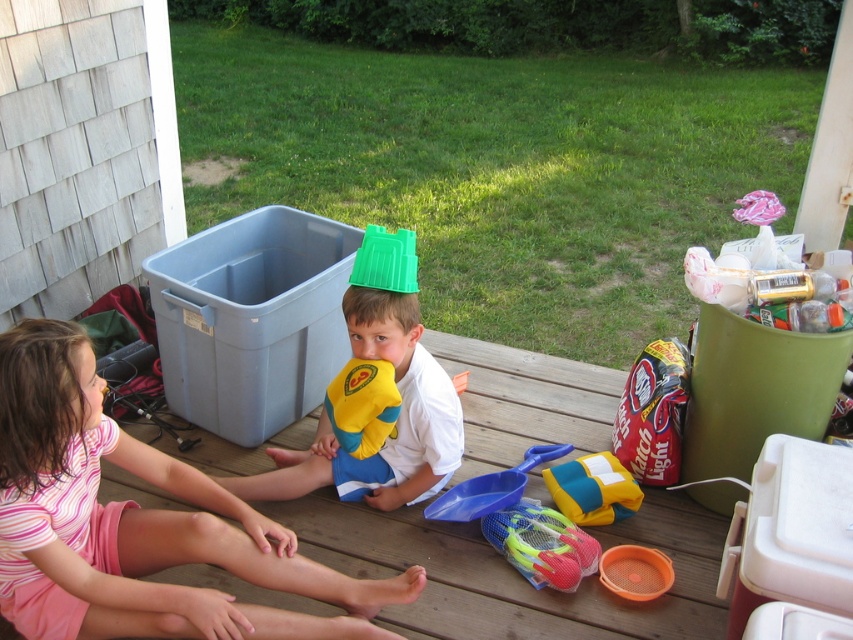
Question: Which point is farther to the camera?

Choices:
 (A) (563, 490)
 (B) (480, 490)
 (C) (276, 611)
 (D) (512, 532)

Answer: (B)

Question: Which object is positioned farthest from the pink cotton dress at lower left?

Choices:
 (A) neon green plastic bucket at lower center
 (B) green plastic bucket at center
 (C) yellow fabric beach ball at center
 (D) blue plastic shovel at center

Answer: (C)

Question: Does pink cotton dress at lower left appear on the right side of yellow fabric beach ball at center?

Choices:
 (A) yes
 (B) no

Answer: (B)

Question: Is yellow fabric beach ball at center positioned before blue plastic shovel at center?

Choices:
 (A) yes
 (B) no

Answer: (B)

Question: Is green plastic bucket at center positioned in front of blue plastic shovel at center?

Choices:
 (A) yes
 (B) no

Answer: (A)

Question: Among these points, which one is nearest to the camera?

Choices:
 (A) (515, 538)
 (B) (561, 468)
 (C) (90, 620)

Answer: (C)